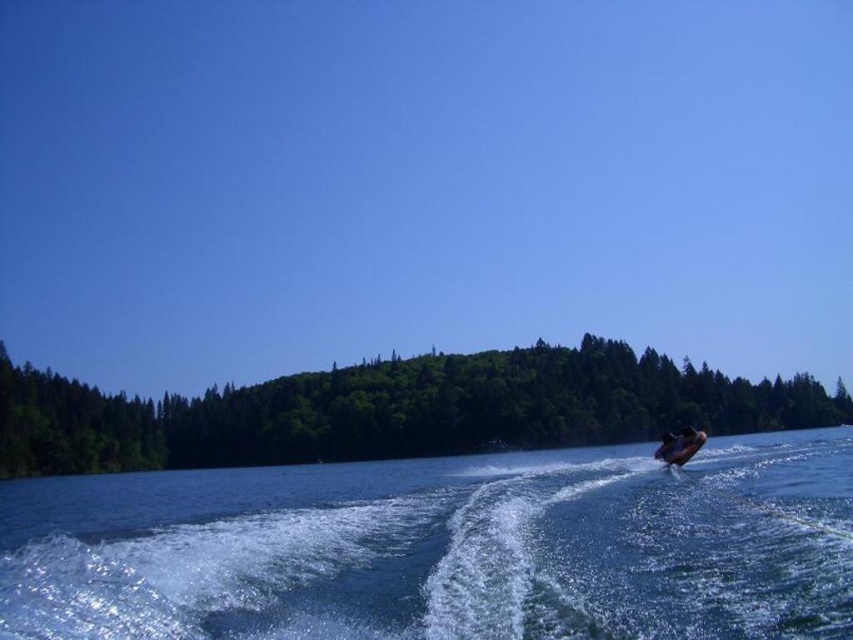
Question: Based on their relative distances, which object is nearer to the shiny metallic jet ski at lower right?

Choices:
 (A) clear blue water at lower right
 (B) green leafy trees at center

Answer: (A)

Question: Which object appears closest to the camera in this image?

Choices:
 (A) green leafy trees at center
 (B) shiny metallic jet ski at lower right
 (C) clear blue water at lower right

Answer: (C)

Question: Which point appears farthest from the camera in this image?

Choices:
 (A) (199, 460)
 (B) (273, 509)
 (C) (689, 432)

Answer: (A)

Question: In this image, where is clear blue water at lower right located relative to green leafy trees at center?

Choices:
 (A) above
 (B) below

Answer: (B)

Question: Observing the image, what is the correct spatial positioning of clear blue water at lower right in reference to shiny metallic jet ski at lower right?

Choices:
 (A) left
 (B) right

Answer: (A)

Question: Considering the relative positions of clear blue water at lower right and green leafy trees at center in the image provided, where is clear blue water at lower right located with respect to green leafy trees at center?

Choices:
 (A) right
 (B) left

Answer: (B)